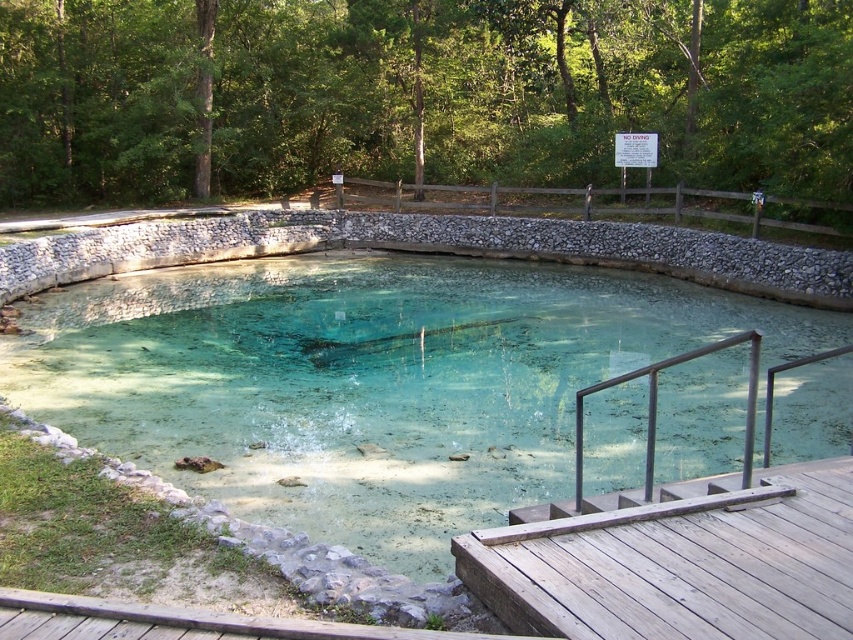
You are standing on the wooden deck leading to the clear stone pond at center. If you want to reach the pond, which direction should you move relative to your current position?

Since the clear stone pond at center is located at point (368, 381), you should move towards the center of the scene to reach it.

You are planning to build a small wooden platform for a bird feeder. You need to decide whether the clear stone pond at center and the brown wooden rail at upper center can support the weight. Based on their sizes, which one is wider and thus more suitable for the platform?

The clear stone pond at center might be wider than brown wooden rail at upper center, so the clear stone pond at center is more suitable for the platform as it can likely support the weight better due to its wider structure.

You are standing on the wooden deck near the clear stone pond at center and want to reach the brown wooden rail at upper center. Which direction should you move to get closer to the rail?

To reach the brown wooden rail at upper center from the clear stone pond at center, you should move upward since the pond is located below the rail.